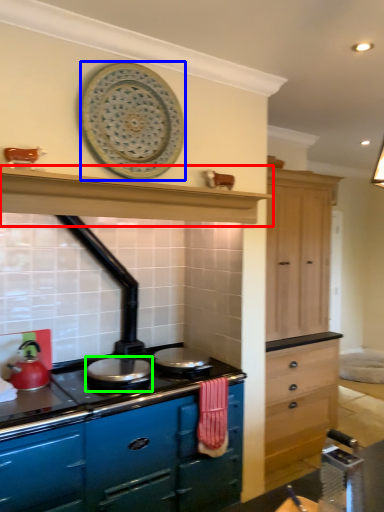
Question: Which object is positioned closest to exhaust hood (highlighted by a red box)? Select from platter (highlighted by a blue box) and appliance (highlighted by a green box).

Choices:
 (A) platter
 (B) appliance

Answer: (A)